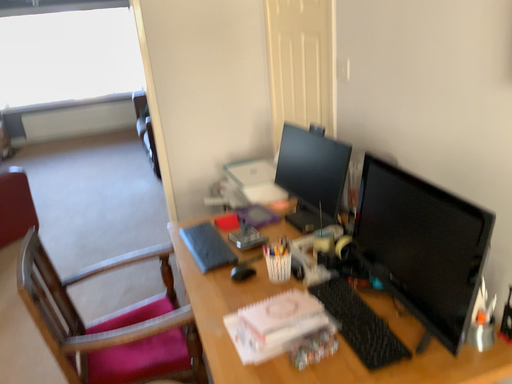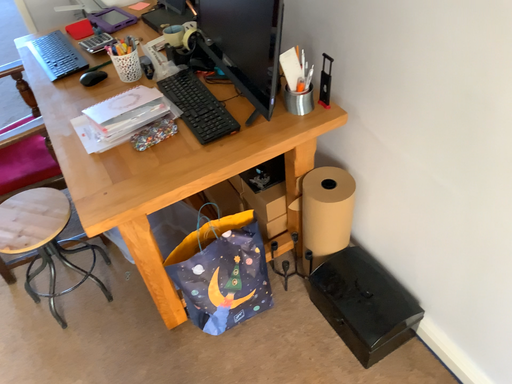
Question: Which way did the camera rotate in the video?

Choices:
 (A) rotated upward
 (B) rotated downward

Answer: (B)